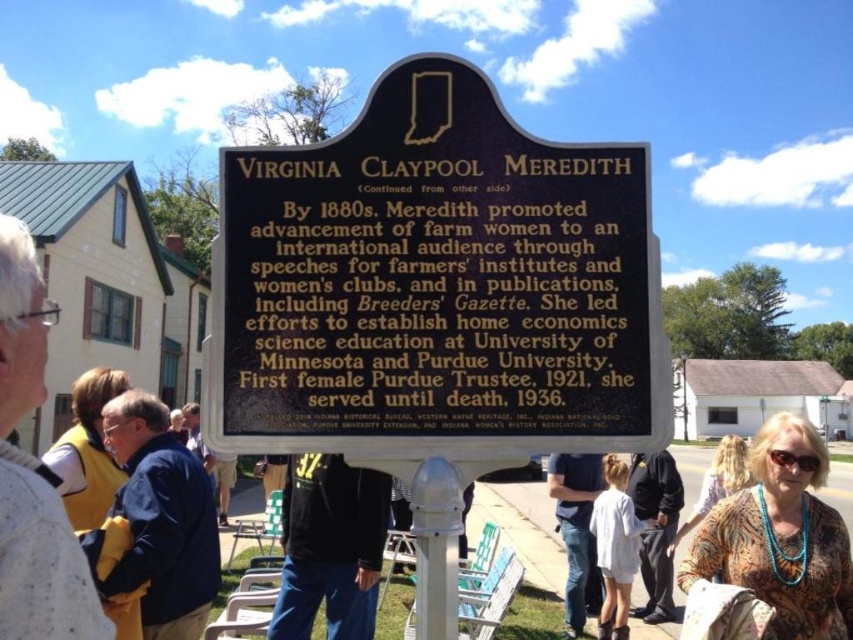
Question: Which is nearer to the turquoise beaded necklace at center?

Choices:
 (A) printed floral blouse at center
 (B) blue fabric jacket at left

Answer: (B)

Question: Which point is farther to the camera?

Choices:
 (A) (770, 499)
 (B) (595, 596)
 (C) (334, 538)
 (D) (721, 474)

Answer: (B)

Question: Which of the following is the closest to the observer?

Choices:
 (A) (601, 401)
 (B) (630, 480)
 (C) (573, 540)

Answer: (A)

Question: Is black polished stone sign at center positioned at the back of dark gray fabric pants at center?

Choices:
 (A) no
 (B) yes

Answer: (A)

Question: Does turquoise beaded necklace at center appear under denim jeans at center?

Choices:
 (A) no
 (B) yes

Answer: (A)

Question: Is turquoise beaded necklace at center closer to the viewer compared to dark gray fabric pants at center?

Choices:
 (A) no
 (B) yes

Answer: (B)